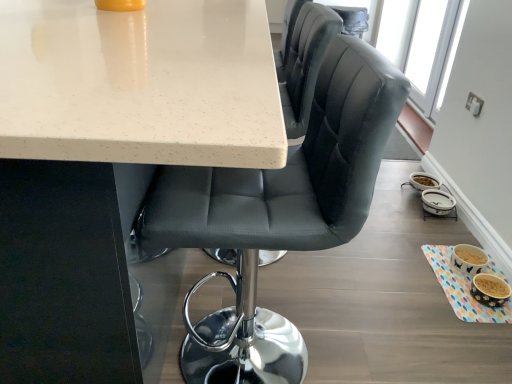
The width and height of the screenshot is (512, 384). What do you see at coordinates (279, 214) in the screenshot?
I see `matte black chair at center` at bounding box center [279, 214].

Measure the distance between point (x=279, y=353) and camera.

The depth of point (x=279, y=353) is 1.26 meters.

This screenshot has height=384, width=512. Describe the element at coordinates (423, 45) in the screenshot. I see `transparent glass window screen at upper right` at that location.

Describe the element at coordinates (110, 159) in the screenshot. I see `white speckled laminate table at upper center` at that location.

Locate an element on the screen. The height and width of the screenshot is (384, 512). matte black chair at center is located at coordinates (279, 214).

Is point (330, 224) closer or farther from the camera than point (76, 53)?

Point (330, 224) is positioned farther from the camera compared to point (76, 53).

Is matte black chair at center oriented towards white speckled laminate table at upper center?

Yes, matte black chair at center is facing white speckled laminate table at upper center.

Is matte black chair at center at the right side of white speckled laminate table at upper center?

Correct, you'll find matte black chair at center to the right of white speckled laminate table at upper center.

Could transparent glass window screen at upper right be considered to be inside matte black chair at center?

Definitely not — transparent glass window screen at upper right is not inside matte black chair at center.

Which is in front, point (236, 291) or point (416, 74)?

Point (236, 291)

At what (x,y) coordinates should I click in order to perform the action: click on window screen behind the matte black chair at center. Please return your answer as a coordinate pair (x, y). Image resolution: width=512 pixels, height=384 pixels. Looking at the image, I should click on (423, 45).

Based on their sizes in the image, would you say matte black chair at center is bigger or smaller than transparent glass window screen at upper right?

Considering their sizes, matte black chair at center takes up more space than transparent glass window screen at upper right.

From a real-world perspective, which is physically above, white speckled laminate table at upper center or matte black chair at center?

From a 3D spatial view, matte black chair at center is above.

How many degrees apart are the facing directions of white speckled laminate table at upper center and matte black chair at center?

They differ by 1.33 degrees in their facing directions.

In the scene shown: Would you say white speckled laminate table at upper center is a long distance from matte black chair at center?

That's not correct — white speckled laminate table at upper center is a little close to matte black chair at center.

Where is `table that is in front of the matte black chair at center`? table that is in front of the matte black chair at center is located at coordinates coord(110,159).

Which object is positioned more to the right, transparent glass window screen at upper right or matte black chair at center?

transparent glass window screen at upper right is more to the right.

From a real-world perspective, between transparent glass window screen at upper right and matte black chair at center, who is vertically higher?

In real-world perspective, matte black chair at center is above.

Is transparent glass window screen at upper right far from matte black chair at center?

Yes, transparent glass window screen at upper right and matte black chair at center are located far from each other.

Considering the points (393, 5) and (239, 338), which point is behind, point (393, 5) or point (239, 338)?

The point (393, 5) is more distant.

From the image's perspective, relative to transparent glass window screen at upper right, is white speckled laminate table at upper center above or below?

white speckled laminate table at upper center is situated lower than transparent glass window screen at upper right in the image.

Based on the photo, can you confirm if white speckled laminate table at upper center is wider than transparent glass window screen at upper right?

Indeed, white speckled laminate table at upper center has a greater width compared to transparent glass window screen at upper right.

How distant is white speckled laminate table at upper center from transparent glass window screen at upper right?

They are 7.81 feet apart.

Would you say white speckled laminate table at upper center is inside or outside transparent glass window screen at upper right?

white speckled laminate table at upper center cannot be found inside transparent glass window screen at upper right.

Is white speckled laminate table at upper center completely or partially inside transparent glass window screen at upper right?

No, white speckled laminate table at upper center is located outside of transparent glass window screen at upper right.

Who is shorter, transparent glass window screen at upper right or white speckled laminate table at upper center?

Standing shorter between the two is transparent glass window screen at upper right.

Can you confirm if transparent glass window screen at upper right is thinner than white speckled laminate table at upper center?

Yes.

Based on the photo, in the image, is transparent glass window screen at upper right on the left side or the right side of white speckled laminate table at upper center?

transparent glass window screen at upper right is positioned on white speckled laminate table at upper center's right side.

Where is `table above the matte black chair at center (from the image's perspective)`? table above the matte black chair at center (from the image's perspective) is located at coordinates (110, 159).

In order to click on window screen that appears below the matte black chair at center (from a real-world perspective) in this screenshot , I will do `click(423, 45)`.

Which object lies further to the anchor point white speckled laminate table at upper center, transparent glass window screen at upper right or matte black chair at center?

Based on the image, transparent glass window screen at upper right appears to be further to white speckled laminate table at upper center.

Estimate the real-world distances between objects in this image. Which object is closer to transparent glass window screen at upper right, white speckled laminate table at upper center or matte black chair at center?

matte black chair at center is closer to transparent glass window screen at upper right.

Which object lies nearer to the anchor point matte black chair at center, transparent glass window screen at upper right or white speckled laminate table at upper center?

white speckled laminate table at upper center lies closer to matte black chair at center than the other object.

When comparing their distances from transparent glass window screen at upper right, does matte black chair at center or white speckled laminate table at upper center seem closer?

The object closer to transparent glass window screen at upper right is matte black chair at center.

From the image, which object appears to be farther from white speckled laminate table at upper center, matte black chair at center or transparent glass window screen at upper right?

Among the two, transparent glass window screen at upper right is located further to white speckled laminate table at upper center.

Looking at the image, which one is located closer to matte black chair at center, white speckled laminate table at upper center or transparent glass window screen at upper right?

The object closer to matte black chair at center is white speckled laminate table at upper center.

This screenshot has height=384, width=512. Find the location of `chair positioned between white speckled laminate table at upper center and transparent glass window screen at upper right from near to far`. chair positioned between white speckled laminate table at upper center and transparent glass window screen at upper right from near to far is located at coordinates (279, 214).